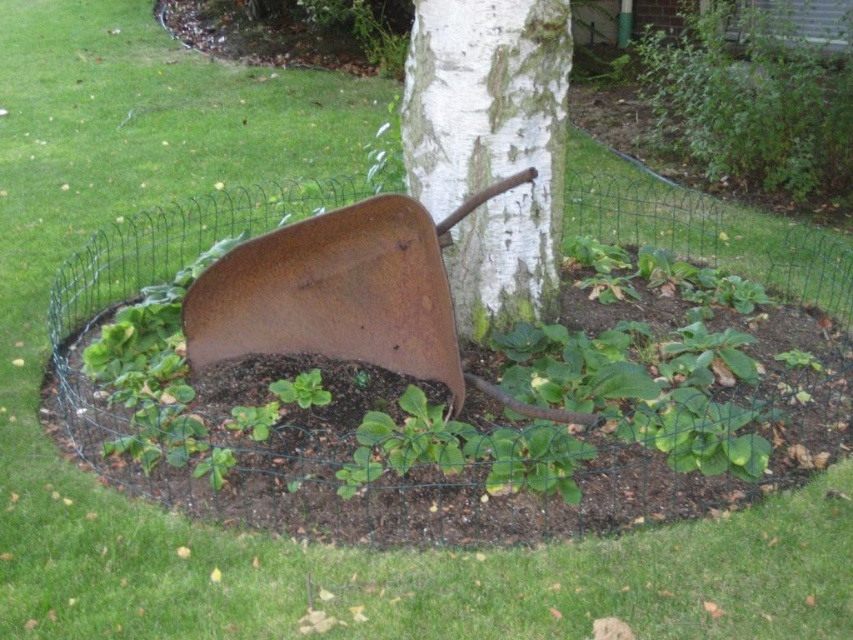
In the scene shown: You are a gardener who needs to determine the relative sizes of the white rough bark tree at center and the rusty metal shovel at center in the garden bed. Which object is smaller?

The white rough bark tree at center is smaller than the rusty metal shovel at center.

You are standing in the garden and want to take a photo of the white rough bark tree at center. If your camera can focus on objects up to 10 feet away, will you need to move closer or farther away to get a clear shot?

The white rough bark tree at center is 11.62 feet away from the camera, which is beyond the camera focus range of 10 feet. You need to move closer to the tree to get a clear shot.